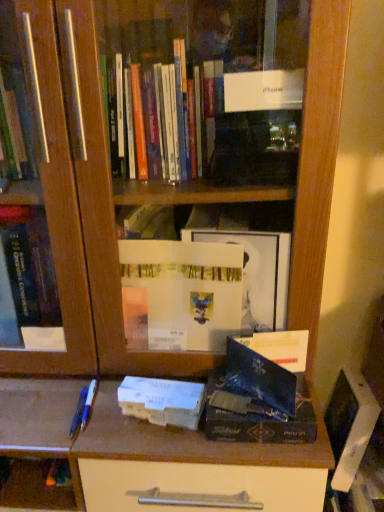
Question: Is blue plastic pen at lower left, arranged as the 1th pen when viewed from the left, positioned with its back to blue plastic pen at lower left, which ranks as the second pen in left-to-right order?

Choices:
 (A) yes
 (B) no

Answer: (B)

Question: Does blue plastic pen at lower left, arranged as the 1th pen when viewed from the left, contain blue plastic pen at lower left, which ranks as the second pen in left-to-right order?

Choices:
 (A) no
 (B) yes

Answer: (A)

Question: From the image's perspective, is blue plastic pen at lower left, arranged as the 1th pen when viewed from the left, beneath blue plastic pen at lower left, which is the first pen in right-to-left order?

Choices:
 (A) yes
 (B) no

Answer: (A)

Question: Does blue plastic pen at lower left, which is counted as the second pen, starting from the right, have a smaller size compared to blue plastic pen at lower left, which is the first pen in right-to-left order?

Choices:
 (A) no
 (B) yes

Answer: (A)

Question: From a real-world perspective, is blue plastic pen at lower left, arranged as the 1th pen when viewed from the left, on top of blue plastic pen at lower left, which is the first pen in right-to-left order?

Choices:
 (A) no
 (B) yes

Answer: (B)

Question: Can you confirm if blue plastic pen at lower left, which is counted as the second pen, starting from the right, is taller than blue plastic pen at lower left, which ranks as the second pen in left-to-right order?

Choices:
 (A) no
 (B) yes

Answer: (B)

Question: Is blue plastic pen at lower left, which is counted as the second pen, starting from the right, outside of shiny black book at center, arranged as the 2th paperback book when viewed from the left?

Choices:
 (A) no
 (B) yes

Answer: (B)

Question: Can you confirm if blue plastic pen at lower left, arranged as the 1th pen when viewed from the left, is smaller than shiny black book at center, arranged as the 2th paperback book when viewed from the left?

Choices:
 (A) yes
 (B) no

Answer: (A)

Question: Is blue plastic pen at lower left, arranged as the 1th pen when viewed from the left, at the left side of shiny black book at center, which appears as the 1th paperback book when viewed from the right?

Choices:
 (A) no
 (B) yes

Answer: (B)

Question: Is the position of blue plastic pen at lower left, arranged as the 1th pen when viewed from the left, more distant than that of shiny black book at center, arranged as the 2th paperback book when viewed from the left?

Choices:
 (A) yes
 (B) no

Answer: (A)

Question: Would you consider blue plastic pen at lower left, arranged as the 1th pen when viewed from the left, to be distant from shiny black book at center, which appears as the 1th paperback book when viewed from the right?

Choices:
 (A) yes
 (B) no

Answer: (B)

Question: Is blue plastic pen at lower left, which is counted as the second pen, starting from the right, bigger than shiny black book at center, arranged as the 2th paperback book when viewed from the left?

Choices:
 (A) yes
 (B) no

Answer: (B)

Question: Is blue plastic pen at lower left, which is the first pen in right-to-left order, looking in the opposite direction of blue plastic pen at lower left, arranged as the 1th pen when viewed from the left?

Choices:
 (A) no
 (B) yes

Answer: (A)